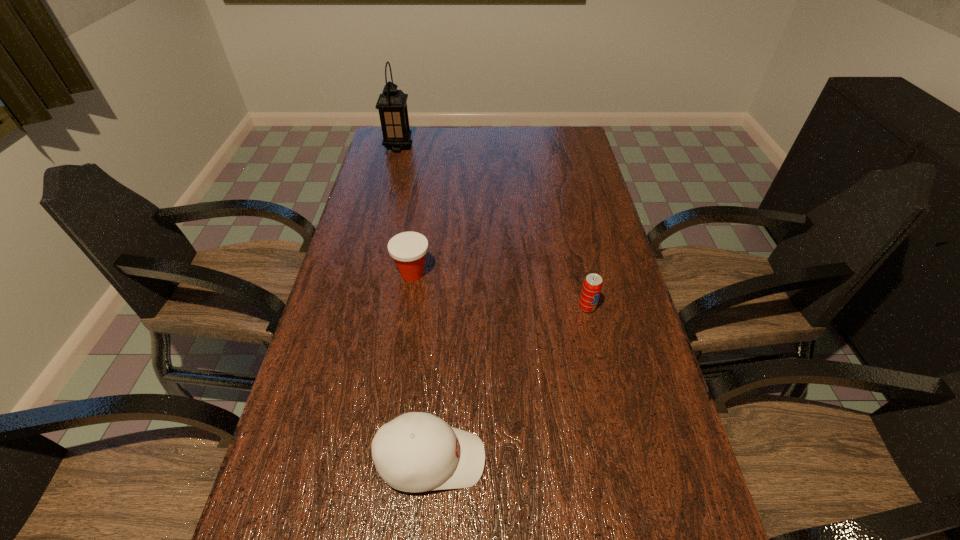
The image size is (960, 540). What are the coordinates of `object that is at the far edge` in the screenshot? It's located at (392, 104).

Image resolution: width=960 pixels, height=540 pixels. What are the coordinates of `object that is at the left edge` in the screenshot? It's located at (392, 104).

The image size is (960, 540). Find the location of `object that is at the right edge`. object that is at the right edge is located at coordinates (592, 285).

Locate an element on the screen. Image resolution: width=960 pixels, height=540 pixels. object located at the far left corner is located at coordinates (392, 104).

In the image, there is a desktop. Identify the location of free space at the far edge. This screenshot has width=960, height=540. (486, 137).

Image resolution: width=960 pixels, height=540 pixels. In the image, there is a desktop. Find the location of `vacant area at the left edge`. vacant area at the left edge is located at coordinates (368, 191).

In the image, there is a desktop. Where is `vacant space at the right edge`? vacant space at the right edge is located at coordinates (591, 224).

You are a GUI agent. You are given a task and a screenshot of the screen. Output one action in this format:
    pyautogui.click(x=<x>, y=<y>)
    Task: Click on the unoccupied position between the soda can and the tallest object
    
    Given the screenshot: What is the action you would take?
    pyautogui.click(x=492, y=227)

You are a GUI agent. You are given a task and a screenshot of the screen. Output one action in this format:
    pyautogui.click(x=<x>, y=<y>)
    Task: Click on the empty space that is in between the rightmost object and the Dixie cup
    
    Given the screenshot: What is the action you would take?
    (499, 291)

What are the coordinates of `free area in between the second nearest object and the nearest object` in the screenshot? It's located at (509, 383).